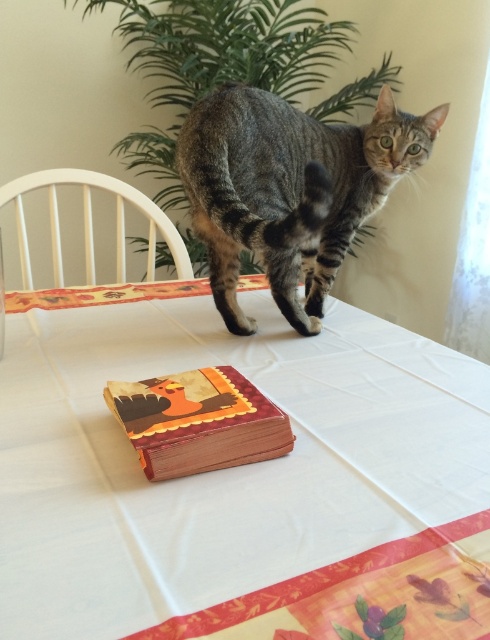
Question: Is white cloth at center positioned at the back of wooden book at center?

Choices:
 (A) yes
 (B) no

Answer: (B)

Question: Is white cloth at center to the left of wooden book at center from the viewer's perspective?

Choices:
 (A) no
 (B) yes

Answer: (A)

Question: Which object is the farthest from the tabby fur cat at center?

Choices:
 (A) wooden book at center
 (B) white cloth at center

Answer: (A)

Question: Which object is farther from the camera taking this photo?

Choices:
 (A) white cloth at center
 (B) wooden book at center

Answer: (B)

Question: Does tabby fur cat at center appear on the right side of wooden book at center?

Choices:
 (A) yes
 (B) no

Answer: (A)

Question: Which point is farther to the camera?

Choices:
 (A) (391, 148)
 (B) (253, 401)

Answer: (A)